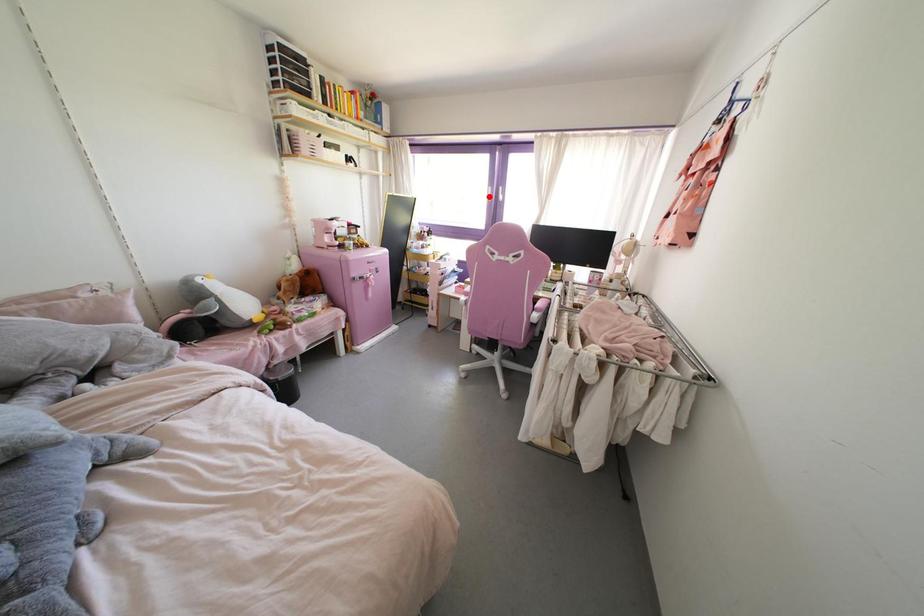
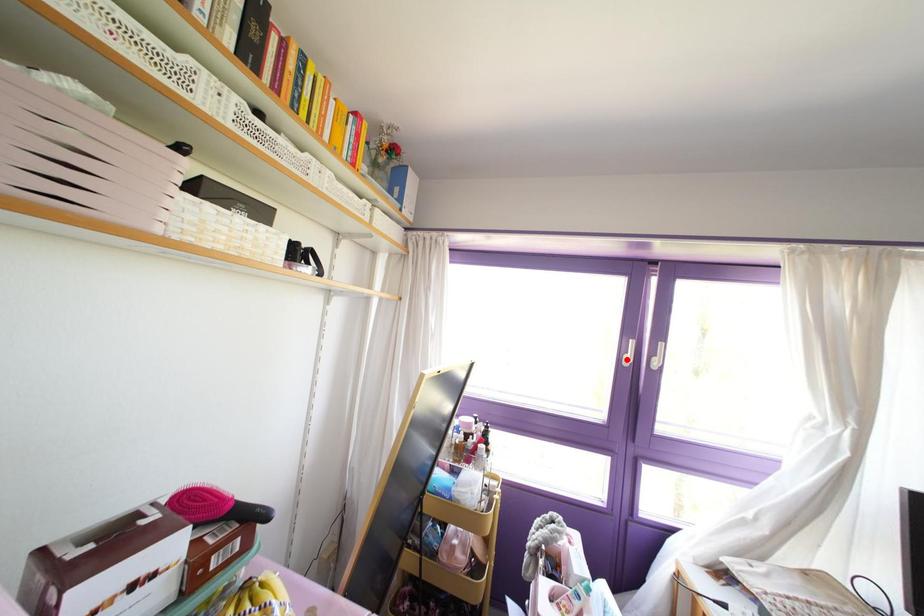
I am providing you with two images of the same scene from different viewpoints. A red point is marked on the first image and another point is marked on the second image. Are the points marked in image1 and image2 representing the same 3D position?

Yes